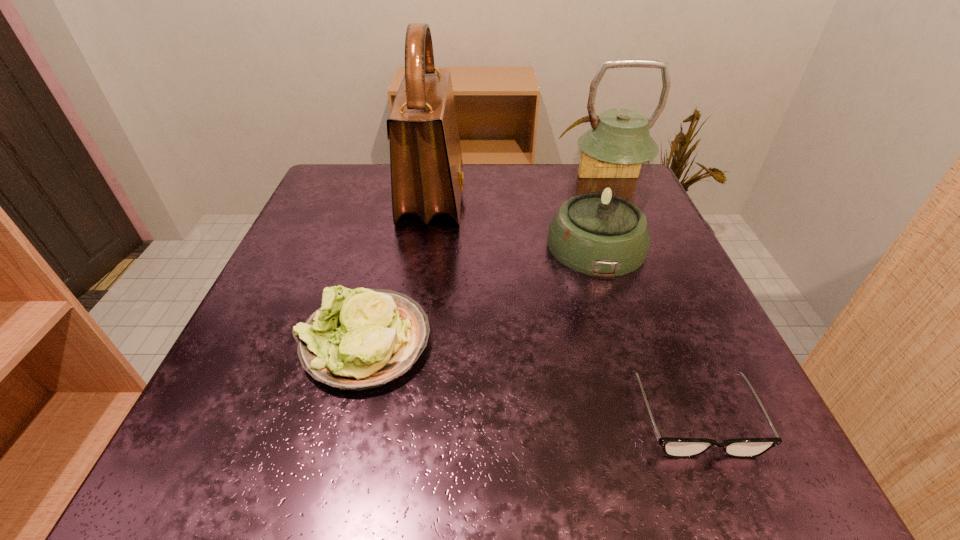
At what (x,y) coordinates should I click in order to perform the action: click on object located at the left edge. Please return your answer as a coordinate pair (x, y). This screenshot has height=540, width=960. Looking at the image, I should click on (364, 338).

Find the location of a particular element. Image resolution: width=960 pixels, height=540 pixels. lantern positioned at the right edge is located at coordinates (601, 230).

Locate an element on the screen. The height and width of the screenshot is (540, 960). spectacles at the right edge is located at coordinates (673, 447).

The image size is (960, 540). In order to click on object that is at the far right corner in this screenshot , I will do `click(601, 230)`.

Locate an element on the screen. The image size is (960, 540). object present at the near right corner is located at coordinates (673, 447).

Find the location of a particular element. This screenshot has height=540, width=960. free space at the far edge of the desktop is located at coordinates (521, 184).

Where is `free space at the near edge`? This screenshot has height=540, width=960. free space at the near edge is located at coordinates (595, 460).

In the image, there is a desktop. In order to click on vacant space at the left edge in this screenshot , I will do `click(317, 219)`.

In the image, there is a desktop. Where is `vacant space at the right edge`? This screenshot has height=540, width=960. vacant space at the right edge is located at coordinates (734, 411).

Where is `vacant space at the far left corner of the desktop`? vacant space at the far left corner of the desktop is located at coordinates (330, 215).